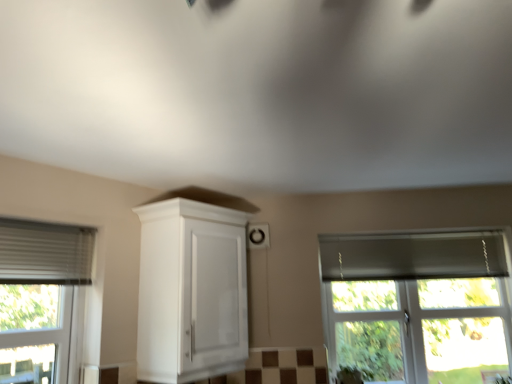
At what (x,y) coordinates should I click in order to perform the action: click on transparent glass window at right. Please return your answer as a coordinate pair (x, y). The width and height of the screenshot is (512, 384). Looking at the image, I should click on (417, 306).

In the scene shown: What is the approximate width of transparent glass window at right?

3.93 inches.

Describe the element at coordinates (417, 306) in the screenshot. This screenshot has height=384, width=512. I see `transparent glass window at right` at that location.

Measure the distance between transparent glass window at right and camera.

A distance of 2.47 meters exists between transparent glass window at right and camera.

This screenshot has width=512, height=384. Find the location of `white glossy cabinet at center`. white glossy cabinet at center is located at coordinates (191, 291).

The height and width of the screenshot is (384, 512). What do you see at coordinates (191, 291) in the screenshot?
I see `white glossy cabinet at center` at bounding box center [191, 291].

The image size is (512, 384). What are the coordinates of `transparent glass window at right` in the screenshot? It's located at (417, 306).

Is white glossy cabinet at center to the right of transparent glass window at right from the viewer's perspective?

No.

Is white glossy cabinet at center closer to the viewer compared to transparent glass window at right?

Yes, white glossy cabinet at center is closer to the camera.

Is point (199, 281) closer or farther from the camera than point (444, 258)?

Point (199, 281).

From the image's perspective, between white glossy cabinet at center and transparent glass window at right, who is located below?

transparent glass window at right appears lower in the image.

From a real-world perspective, which object rests below the other?

transparent glass window at right, from a real-world perspective.

Between white glossy cabinet at center and transparent glass window at right, which one has larger width?

white glossy cabinet at center.

Who is taller, white glossy cabinet at center or transparent glass window at right?

transparent glass window at right.

Does white glossy cabinet at center have a smaller size compared to transparent glass window at right?

Incorrect, white glossy cabinet at center is not smaller in size than transparent glass window at right.

Can we say white glossy cabinet at center lies outside transparent glass window at right?

white glossy cabinet at center is positioned outside transparent glass window at right.

Is white glossy cabinet at center not close to transparent glass window at right?

Yes.

Based on the photo, is white glossy cabinet at center oriented towards transparent glass window at right?

No, white glossy cabinet at center does not turn towards transparent glass window at right.

How far apart are white glossy cabinet at center and transparent glass window at right?

A distance of 1.02 meters exists between white glossy cabinet at center and transparent glass window at right.

Where is `window on the right of white glossy cabinet at center`? window on the right of white glossy cabinet at center is located at coordinates (417, 306).

Would you say transparent glass window at right is to the left or to the right of white glossy cabinet at center in the picture?

transparent glass window at right is to the right of white glossy cabinet at center.

Which is in front, transparent glass window at right or white glossy cabinet at center?

Positioned in front is white glossy cabinet at center.

Is point (336, 361) positioned before point (186, 340)?

That is False.

From the image's perspective, which object appears higher, transparent glass window at right or white glossy cabinet at center?

white glossy cabinet at center.

From a real-world perspective, who is located lower, transparent glass window at right or white glossy cabinet at center?

In real-world perspective, transparent glass window at right is lower.

Is transparent glass window at right thinner than white glossy cabinet at center?

Yes.

Considering the relative sizes of transparent glass window at right and white glossy cabinet at center in the image provided, is transparent glass window at right taller than white glossy cabinet at center?

Correct, transparent glass window at right is much taller as white glossy cabinet at center.

Considering the sizes of objects transparent glass window at right and white glossy cabinet at center in the image provided, who is smaller, transparent glass window at right or white glossy cabinet at center?

With smaller size is transparent glass window at right.

Would you say transparent glass window at right is inside or outside white glossy cabinet at center?

The correct answer is: outside.

Are transparent glass window at right and white glossy cabinet at center located far from each other?

Indeed, transparent glass window at right is not near white glossy cabinet at center.

Consider the image. Does transparent glass window at right turn towards white glossy cabinet at center?

No.

Where is `window behind the white glossy cabinet at center`? Image resolution: width=512 pixels, height=384 pixels. window behind the white glossy cabinet at center is located at coordinates (417, 306).

This screenshot has width=512, height=384. I want to click on window that is behind the white glossy cabinet at center, so [x=417, y=306].

The height and width of the screenshot is (384, 512). I want to click on window directly beneath the white glossy cabinet at center (from a real-world perspective), so click(417, 306).